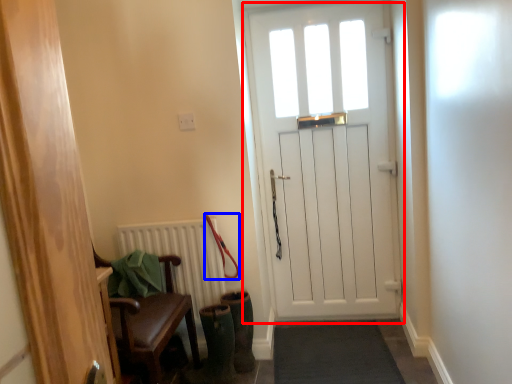
Question: Which object is further to the camera taking this photo, screen door (highlighted by a red box) or leash (highlighted by a blue box)?

Choices:
 (A) screen door
 (B) leash

Answer: (A)